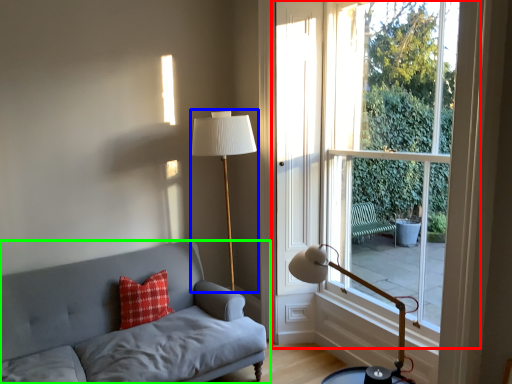
Question: Based on their relative distances, which object is nearer to window (highlighted by a red box)? Choose from table lamp (highlighted by a blue box) and studio couch (highlighted by a green box).

Choices:
 (A) table lamp
 (B) studio couch

Answer: (A)